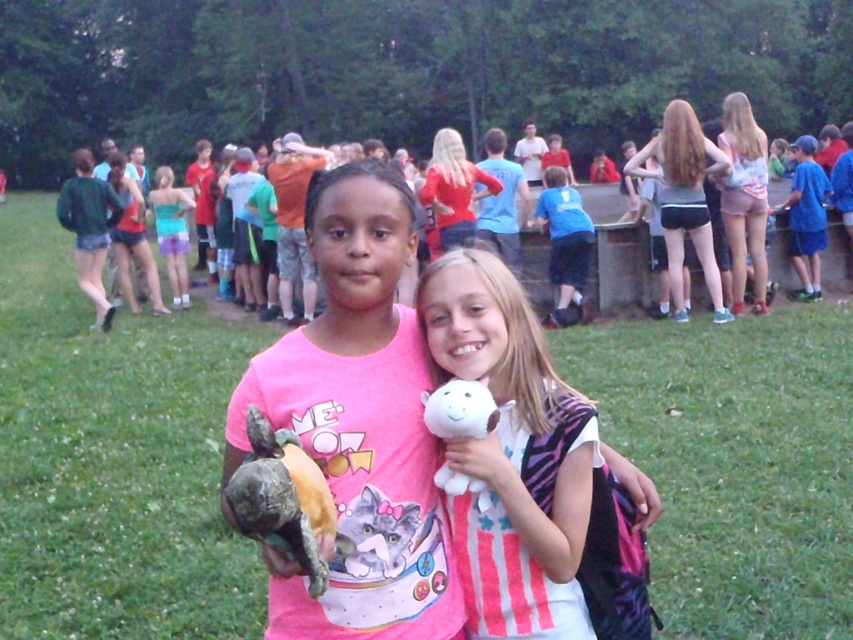
Question: Does green matte jacket at left come behind blue cotton shirt at center?

Choices:
 (A) yes
 (B) no

Answer: (A)

Question: Considering the relative positions of white plush toy at center and matte black shorts at right in the image provided, where is white plush toy at center located with respect to matte black shorts at right?

Choices:
 (A) right
 (B) left

Answer: (B)

Question: From the image, what is the correct spatial relationship of white plush toy at center in relation to matte red shirt at upper center?

Choices:
 (A) below
 (B) above

Answer: (A)

Question: Based on their relative distances, which object is nearer to the matte red shirt at upper center?

Choices:
 (A) blue cotton shirt at right
 (B) green matte jacket at left

Answer: (A)

Question: Which of the following is the farthest from the observer?

Choices:
 (A) (801, 280)
 (B) (426, 189)

Answer: (A)

Question: Among these points, which one is nearest to the camera?

Choices:
 (A) (107, 321)
 (B) (444, 182)

Answer: (B)